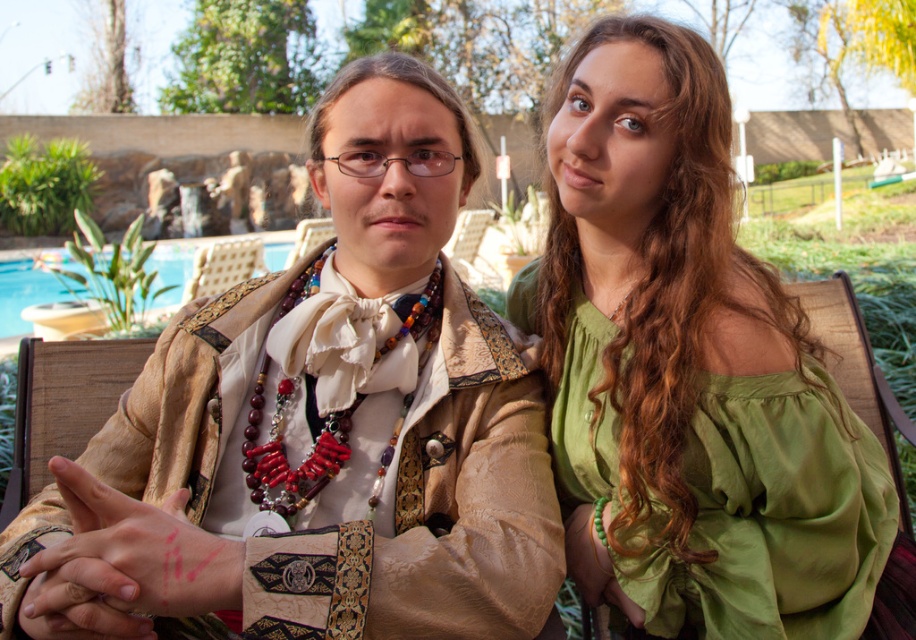
You are a photographer who wants to capture a photo of the green silk blouse at upper right and the blue glass pool at left. Which object is located to the right of the other?

The green silk blouse at upper right is positioned on the right side of blue glass pool at left.

Please look at the scene and locate the point at coordinates (124, 564). What object is exactly at that point?

The point at coordinates (124, 564) corresponds to the matte brown leather hand at center.